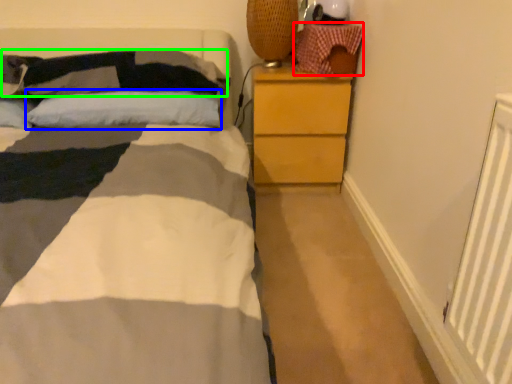
Question: Based on their relative distances, which object is farther from material (highlighted by a red box)? Choose from pillow (highlighted by a blue box) and pillow (highlighted by a green box).

Choices:
 (A) pillow
 (B) pillow

Answer: (B)